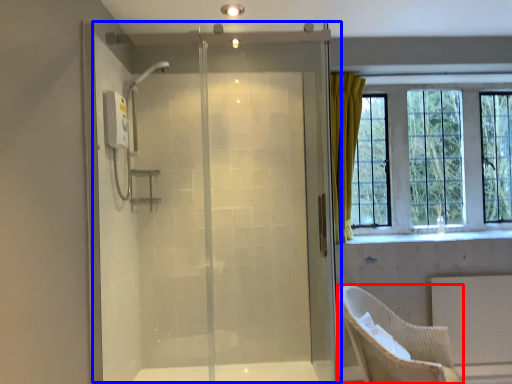
Question: Which of the following is the closest to the observer, chair (highlighted by a red box) or screen door (highlighted by a blue box)?

Choices:
 (A) chair
 (B) screen door

Answer: (A)